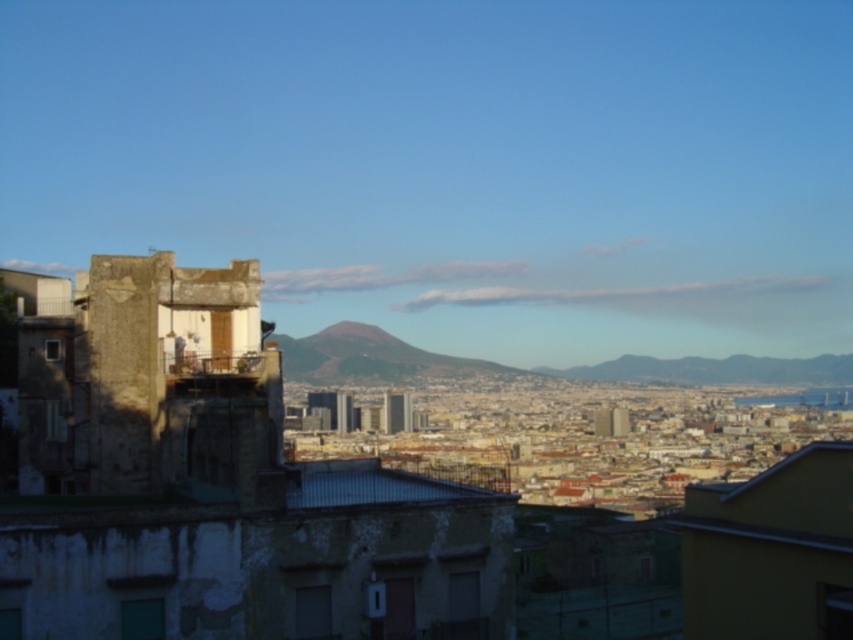
You are a city planner analyzing the cityscape. You notice two mountains in the center of the image, the volcanic rock mountain at center and the rugged stone mountain at center. Which mountain is narrower in width?

The volcanic rock mountain at center has a lesser width compared to the rugged stone mountain at center, so the volcanic rock mountain at center is narrower in width.

You are a hiker planning to climb both the volcanic rock mountain at center and the rugged stone mountain at center. Based on the cityscape view, which mountain would require a longer climb to reach its summit?

The volcanic rock mountain at center is taller than the rugged stone mountain at center, so it would require a longer climb to reach its summit.

From the picture: You are standing on a hillside overlooking the city. You see two mountains in the center of the image, the volcanic rock mountain at center and the rugged stone mountain at center. Which mountain is closer to you?

The volcanic rock mountain at center is closer to the viewer than the rugged stone mountain at center.